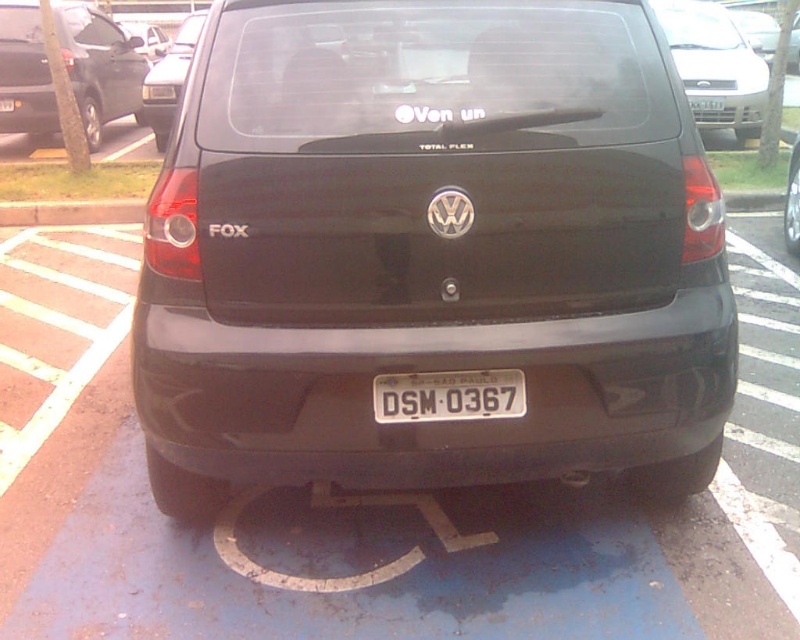
Consider the image. You are standing at the point marked by coordinates point (x=432, y=250) in the parking lot. What object are you directly at?

You are directly at the matte black car at center.

You are a parking attendant checking if vehicles are parked correctly. You notice the white metallic license plate at center and the smooth concrete curb at lower left. Based on their positions, is the car properly parked within the designated parking space?

The white metallic license plate at center is positioned under the smooth concrete curb at lower left, which means the car is not properly parked within the designated parking space because the license plate should be aligned with the curb for correct positioning.